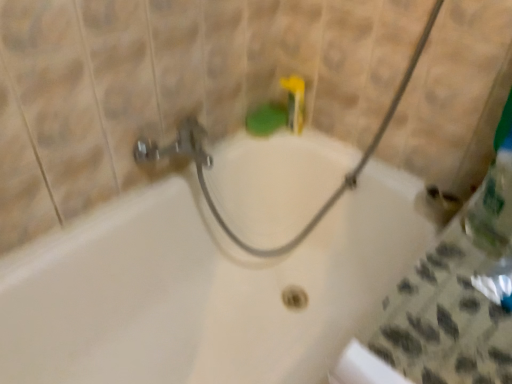
You are a GUI agent. You are given a task and a screenshot of the screen. Output one action in this format:
    pyautogui.click(x=<x>, y=<y>)
    Task: Click on the white glossy bathtub at center
    
    Given the screenshot: What is the action you would take?
    pyautogui.click(x=200, y=290)

What do you see at coordinates (200, 290) in the screenshot?
I see `white glossy bathtub at center` at bounding box center [200, 290].

Locate an element on the screen. This screenshot has height=384, width=512. white glossy bathtub at center is located at coordinates (200, 290).